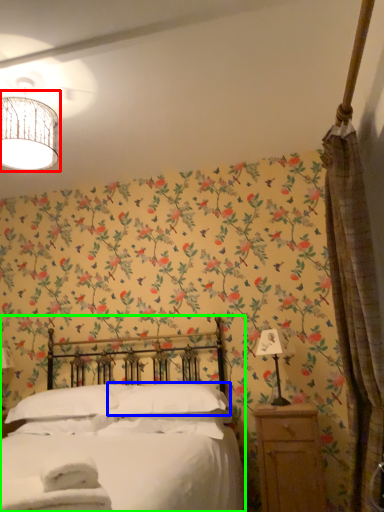
Question: Estimate the real-world distances between objects in this image. Which object is closer to lamp (highlighted by a red box), pillow (highlighted by a blue box) or bed (highlighted by a green box)?

Choices:
 (A) pillow
 (B) bed

Answer: (B)